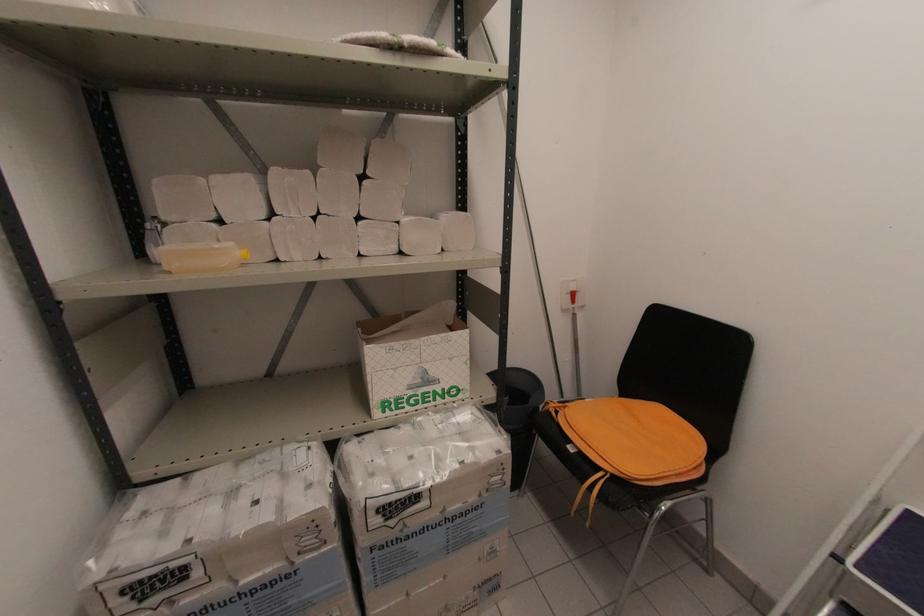
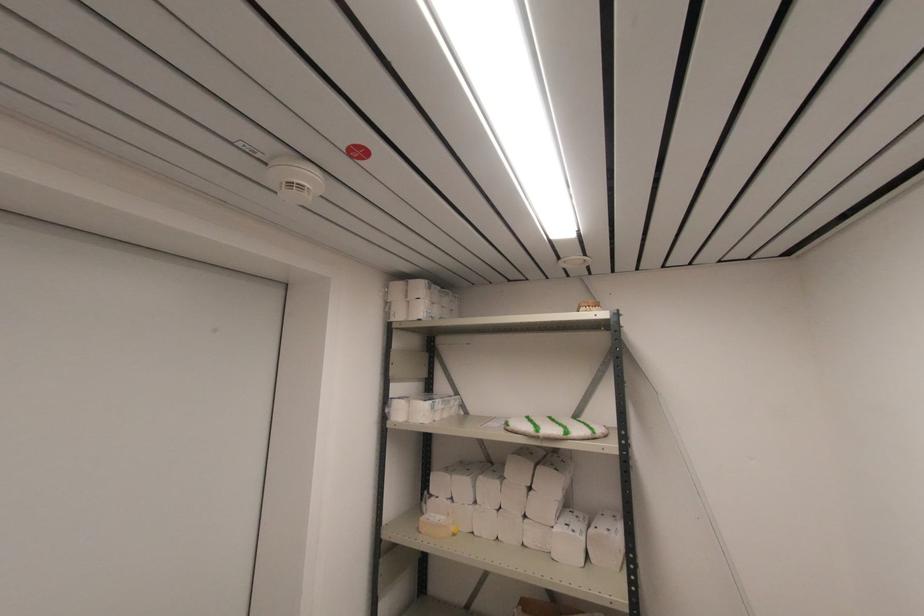
Where in the second image is the point corresponding to point (169, 273) from the first image?

(420, 533)